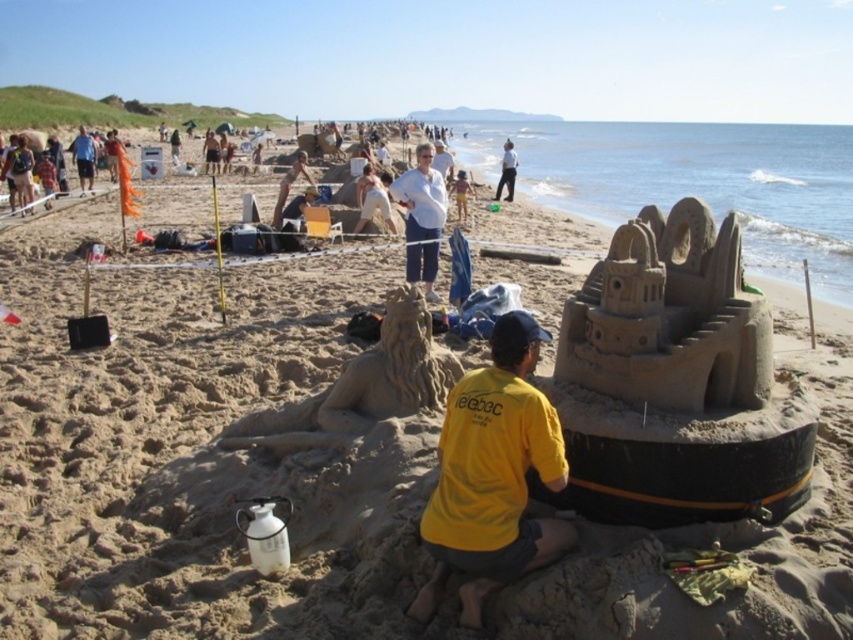
You are a photographer trying to capture the person working on the sand sculpture. Which part of their clothing is visible first when looking from the front? The yellow fabric shirt at lower center or the light blue denim shorts at center?

The light blue denim shorts at center is visible first because the yellow fabric shirt at lower center is positioned under it.

You are a photographer trying to capture the sand sculptures from a specific angle. You notice the yellow fabric shirt at lower center and the light blue denim shorts at center. Which clothing item is located more to the left in the image?

The yellow fabric shirt at lower center is positioned on the left side of light blue denim shorts at center, so the yellow fabric shirt at lower center is more to the left.